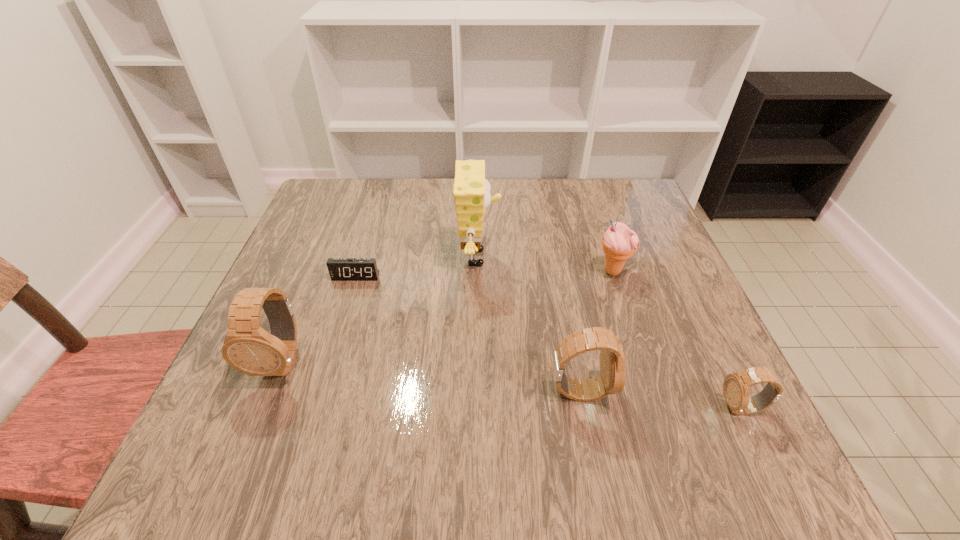
Locate an element on the screen. the leftmost watch is located at coordinates (247, 347).

Locate an element on the screen. Image resolution: width=960 pixels, height=540 pixels. the third object from right to left is located at coordinates (611, 380).

Locate an element on the screen. This screenshot has width=960, height=540. the second tallest watch is located at coordinates (611, 380).

Image resolution: width=960 pixels, height=540 pixels. What are the coordinates of `the rightmost watch` in the screenshot? It's located at (736, 387).

Find the location of a particular element. the second shortest object is located at coordinates (736, 387).

Locate an element on the screen. Image resolution: width=960 pixels, height=540 pixels. icecream is located at coordinates (619, 243).

At what (x,y) coordinates should I click in order to perform the action: click on the tallest object. Please return your answer as a coordinate pair (x, y). This screenshot has height=540, width=960. Looking at the image, I should click on (471, 191).

Locate an element on the screen. This screenshot has width=960, height=540. sponge is located at coordinates (471, 191).

At what (x,y) coordinates should I click in order to perform the action: click on the shortest object. Please return your answer as a coordinate pair (x, y). Looking at the image, I should click on (340, 269).

Find the location of a particular element. The width and height of the screenshot is (960, 540). vacant region located on the face of the leftmost watch is located at coordinates (261, 414).